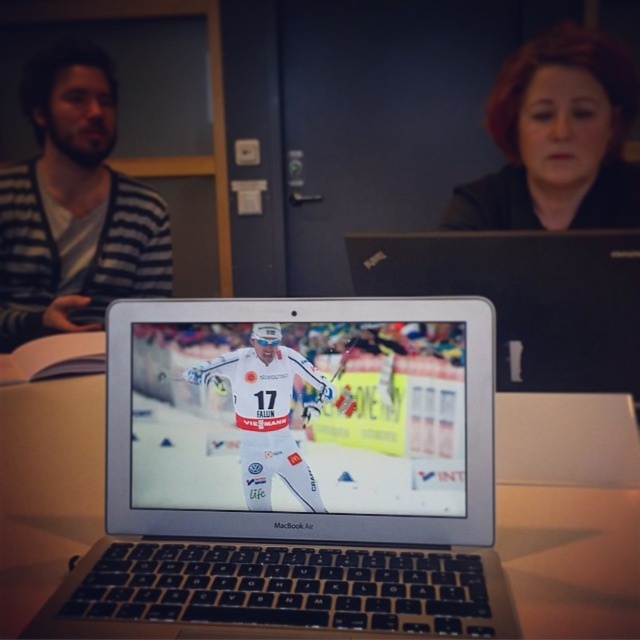
You are a photographer in a dimly lit room. You need to take a photo of the silver metallic laptop at center and the smooth black hair at upper right. Which object should you focus on first to ensure both are in sharp focus?

The silver metallic laptop at center is located below smooth black hair at upper right, so you should focus on the smooth black hair at upper right first since it is farther away and adjusting focus from far to near can help ensure both are in sharp focus.

You are a photographer in a dimly lit room and want to take a photo of the striped sweater at left and smooth black hair at upper right. Which object should you focus on to ensure it appears larger in the photo?

The striped sweater at left should be focused on because it has a greater height compared to the smooth black hair at upper right, making it naturally larger in the photo.

You are a person with a height of 1.7 meters. You are standing in front of the silver metallic laptop at center. Can you see the screen clearly without bending down or leaning forward?

The silver metallic laptop at center is 44.96 centimeters away from the viewer. Since the laptop is placed at center and the viewer is standing, the distance is sufficient to see the screen clearly without bending down or leaning forward.